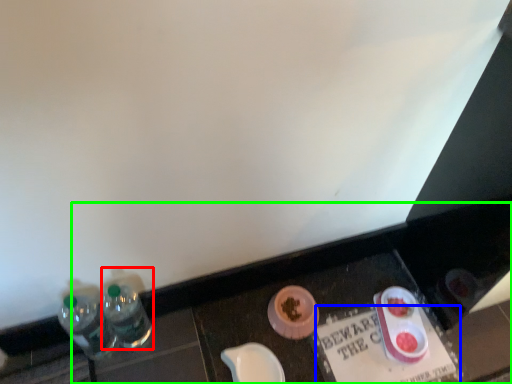
Question: Considering the real-world distances, which object is farthest from bottle (highlighted by a red box)? writing (highlighted by a blue box) or vanity (highlighted by a green box)?

Choices:
 (A) writing
 (B) vanity

Answer: (A)